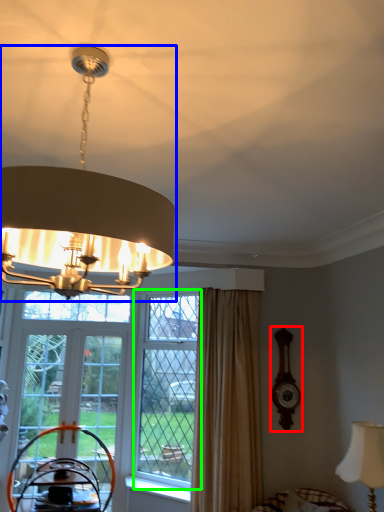
Question: Which is farther away from clock (highlighted by a red box)? lamp (highlighted by a blue box) or window (highlighted by a green box)?

Choices:
 (A) lamp
 (B) window

Answer: (A)